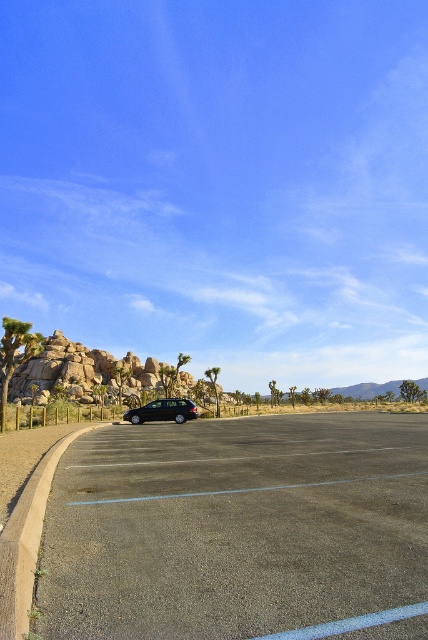
From the picture: You are a delivery drone that needs to land in the gray asphalt parking lot at center. The black matte car at center is in your landing path. Can you safely land in the parking lot without hitting the car?

The gray asphalt parking lot at center has a larger size compared to the black matte car at center, so there is enough space to land safely without hitting the car.

You are standing at the edge of the gray asphalt parking lot at center and want to find the black matte car at center. According to the scene description, which direction should you look to locate the car?

The gray asphalt parking lot at center is to the right of the black matte car at center, so you should look to your left to find the car.